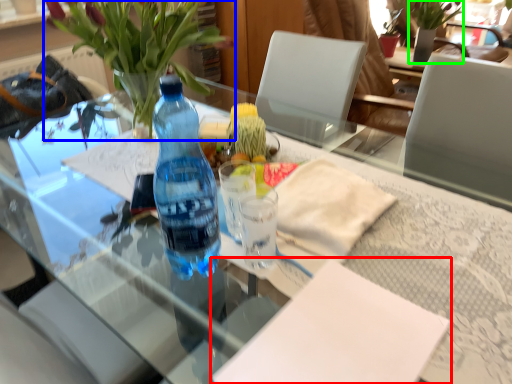
Question: Which is farther away from notepad (highlighted by a red box)? houseplant (highlighted by a blue box) or bouquet (highlighted by a green box)?

Choices:
 (A) houseplant
 (B) bouquet

Answer: (B)